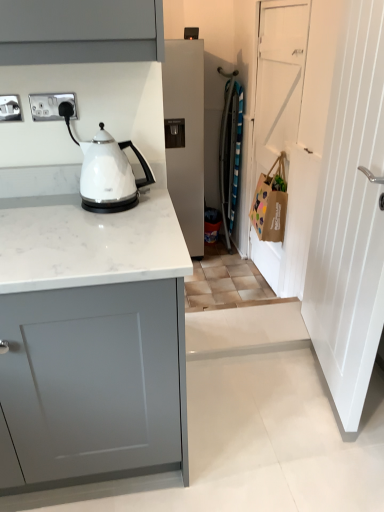
Question: Is chrome metallic plug socket at left, the 1th electric outlet from the right, surrounded by white glossy kettle at left?

Choices:
 (A) no
 (B) yes

Answer: (A)

Question: Is white glossy kettle at left oriented towards chrome metallic plug socket at left, the 1th electric outlet from the right?

Choices:
 (A) no
 (B) yes

Answer: (A)

Question: From the image's perspective, does white glossy kettle at left appear lower than chrome metallic plug socket at left, the second electric outlet from the left?

Choices:
 (A) no
 (B) yes

Answer: (B)

Question: Is white glossy kettle at left facing away from chrome metallic plug socket at left, the 1th electric outlet from the right?

Choices:
 (A) no
 (B) yes

Answer: (A)

Question: Does white glossy kettle at left lie in front of chrome metallic plug socket at left, the second electric outlet from the left?

Choices:
 (A) yes
 (B) no

Answer: (A)

Question: Is white glossy kettle at left taller than chrome metallic plug socket at left, the 1th electric outlet from the right?

Choices:
 (A) no
 (B) yes

Answer: (B)

Question: Does white marble countertop at center have a greater width compared to white matte refrigerator at center?

Choices:
 (A) no
 (B) yes

Answer: (A)

Question: Is white marble countertop at center completely or partially outside of white matte refrigerator at center?

Choices:
 (A) yes
 (B) no

Answer: (A)

Question: Does white marble countertop at center have a smaller size compared to white matte refrigerator at center?

Choices:
 (A) yes
 (B) no

Answer: (B)

Question: Is white marble countertop at center facing away from white matte refrigerator at center?

Choices:
 (A) no
 (B) yes

Answer: (B)

Question: Is white marble countertop at center directly adjacent to white matte refrigerator at center?

Choices:
 (A) yes
 (B) no

Answer: (B)

Question: Does white marble countertop at center have a greater height compared to white matte refrigerator at center?

Choices:
 (A) no
 (B) yes

Answer: (A)

Question: Is white wooden door at right, the first door when ordered from front to back, a part of white matte door at right, which ranks as the first door in back-to-front order?

Choices:
 (A) yes
 (B) no

Answer: (B)